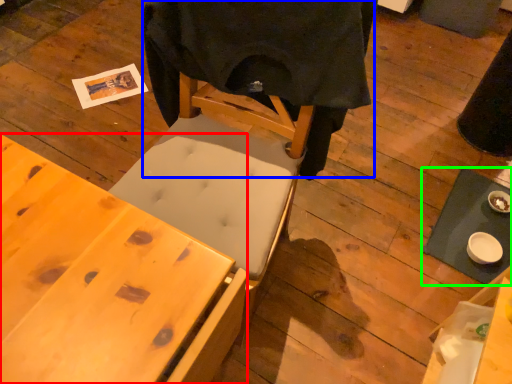
Question: Considering the real-world distances, which object is closest to desk (highlighted by a red box)? cloth (highlighted by a blue box) or table (highlighted by a green box).

Choices:
 (A) cloth
 (B) table

Answer: (A)